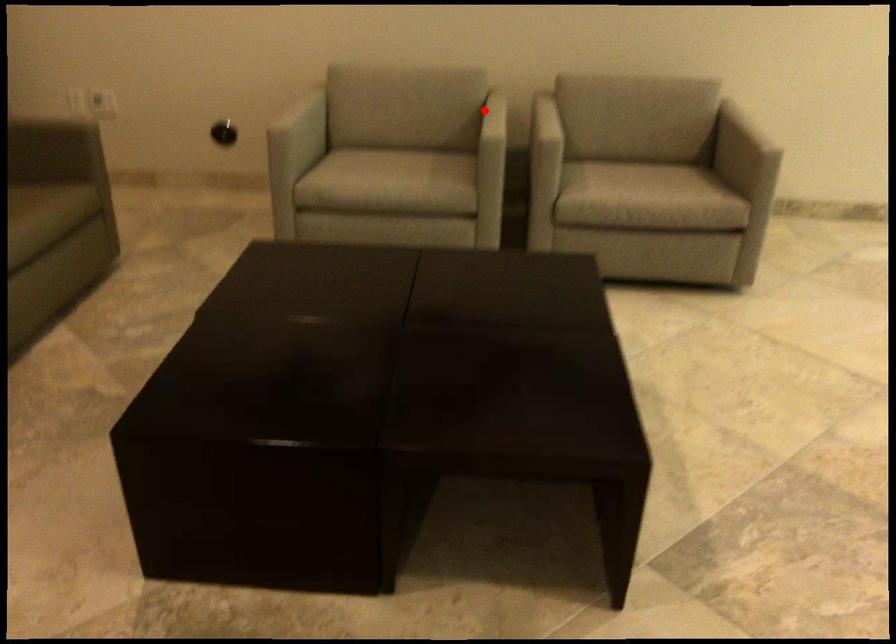
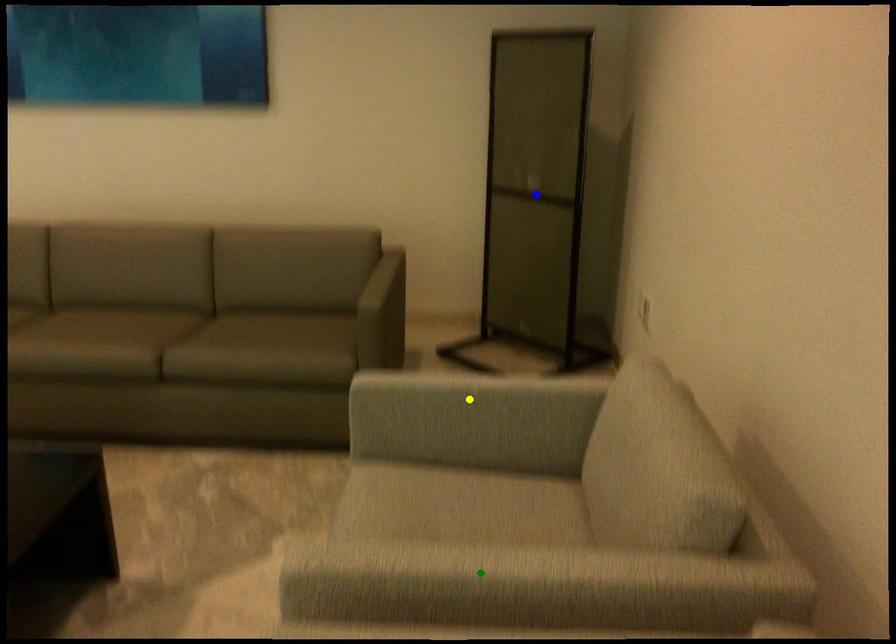
Question: I am providing you with two images of the same scene from different viewpoints. A red point is marked on the first image. You are given multiple points on the second image. Which spot in image 2 lines up with the point in image 1?

Choices:
 (A) green point
 (B) yellow point
 (C) blue point

Answer: (A)